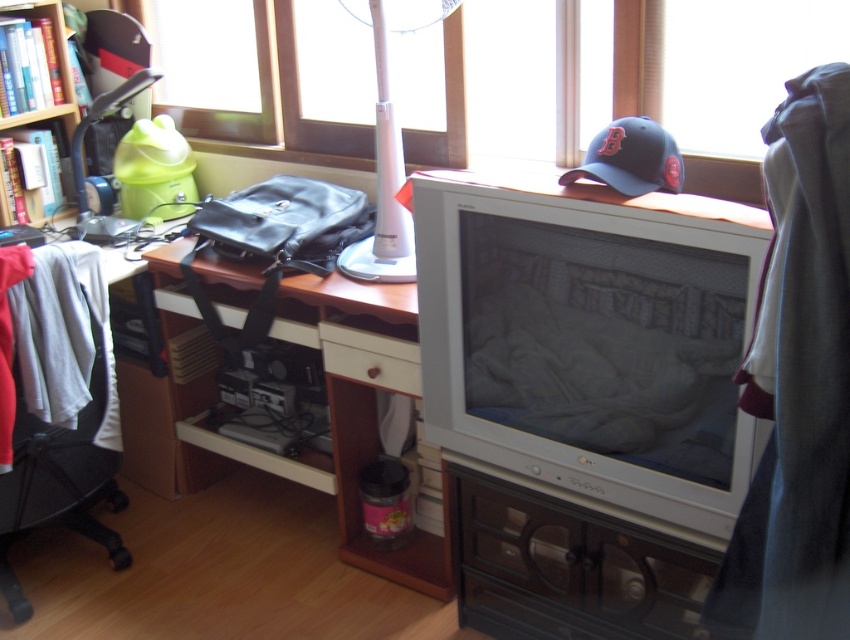
Question: Which point is farther to the camera?

Choices:
 (A) wooden bookcase at upper left
 (B) gray fabric at upper right
 (C) woodendesk at center

Answer: (A)

Question: Does black fabric swivel chair at left have a smaller size compared to white plastic lamp at upper center?

Choices:
 (A) no
 (B) yes

Answer: (A)

Question: Which object is the farthest from the white plastic monitor at center?

Choices:
 (A) white wood drawer at center
 (B) wooden bookcase at upper left
 (C) white plastic lamp at upper center
 (D) white plastic drawer at center

Answer: (B)

Question: Is dark blue fabric baseball cap at upper right further to the viewer compared to wooden bookcase at upper left?

Choices:
 (A) no
 (B) yes

Answer: (A)

Question: Observing the image, what is the correct spatial positioning of woodendesk at center in reference to white wood drawer at center?

Choices:
 (A) above
 (B) below

Answer: (B)

Question: Among these points, which one is farthest from the camera?

Choices:
 (A) (553, 593)
 (B) (762, 522)
 (C) (326, 362)
 (D) (173, 296)

Answer: (D)